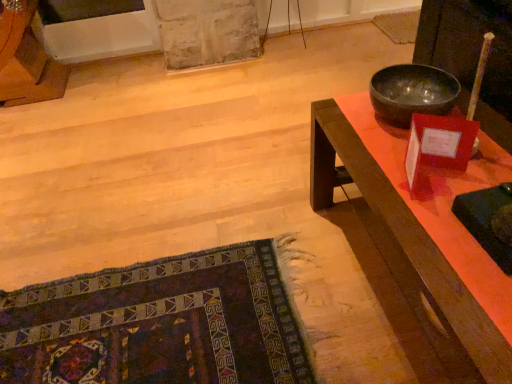
Image resolution: width=512 pixels, height=384 pixels. I want to click on free space above dark woven rug at lower left (from a real-world perspective), so pyautogui.click(x=164, y=317).